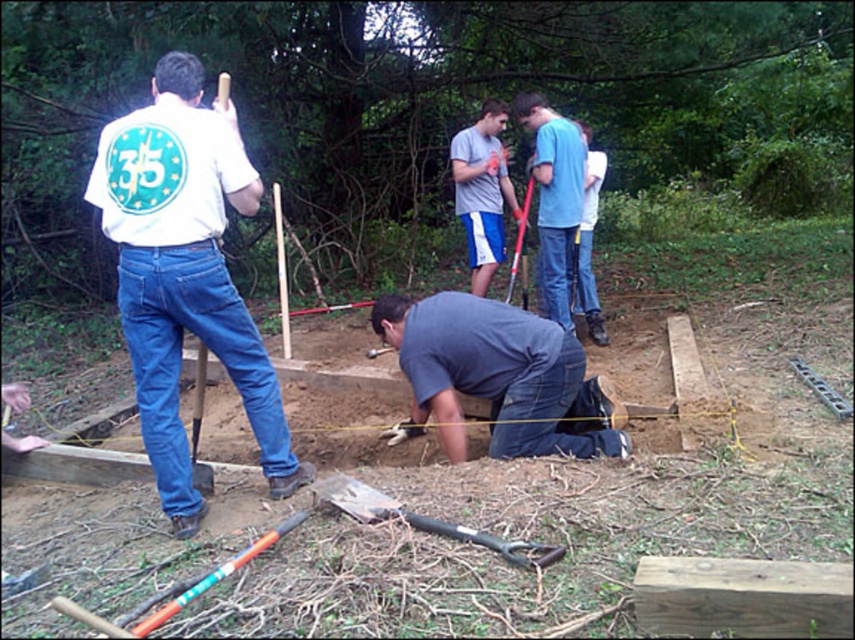
You are a construction worker standing at the edge of the trench. You need to place a safety cone between the two points, point (552, 252) and point (500, 556). Which point should the cone be closer to in order to be nearer to the viewer?

The safety cone should be placed closer to point (552, 252) because it is closer to the viewer than point (500, 556).

You are a construction supervisor observing the workers in the scene. You need to ensure that the white matte shirt at left and dark gray shirt at center are visible to you. Which worker is narrower in width?

The white matte shirt at left has a lesser width compared to dark gray shirt at center, so the worker wearing the white matte shirt at left is narrower.

Looking at this image, you are a safety inspector observing the construction site. You notice two workers wearing the white matte shirt at left and dark gray shirt at center. According to safety protocols, workers must maintain a minimum distance of 2 meters between each other to prevent accidents. Can you determine if they are complying with this rule?

The white matte shirt at left is in front of the dark gray shirt at center, which means they are positioned closer than 2 meters apart. Therefore, they are not complying with the safety protocol requiring a minimum distance of 2 meters between workers.